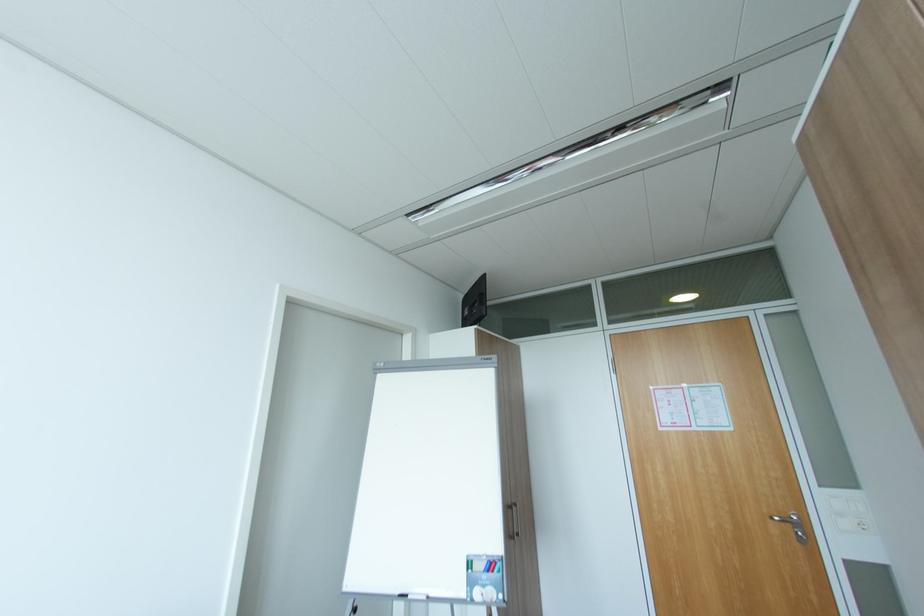
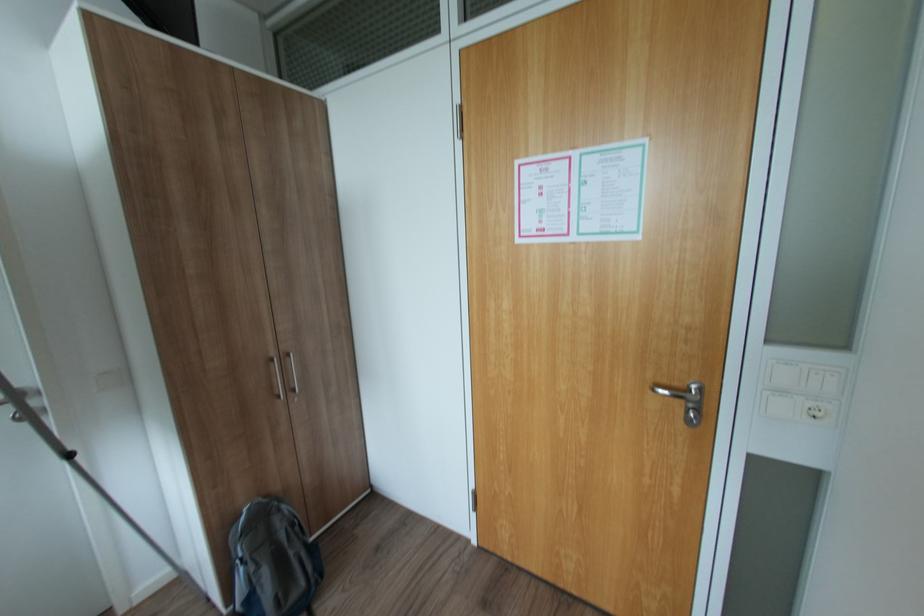
Find the pixel in the second image that matches point (783, 517) in the first image.

(664, 390)